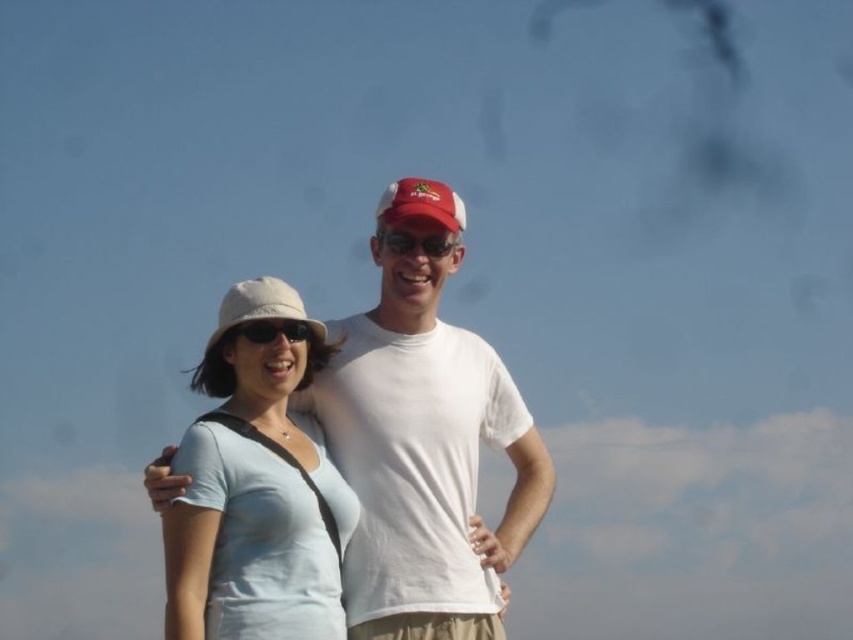
You are a photographer taking a photo of the light blue cotton shirt at center and the beige fabric baseball hat at center. Which object should you focus on first if you want to capture both in sharp focus?

The light blue cotton shirt at center is much taller than the beige fabric baseball hat at center, so you should focus on the taller object first to ensure both are in sharp focus.

You are a photographer trying to capture the light blue cotton shirt at center in the image. Given that the camera focuses on the point marked at coordinates point (424,456), will the light blue cotton shirt at center be in focus?

Yes, the point (424,456) indicates the location of the light blue cotton shirt at center, so the camera will focus on it directly.

In the scene shown: You are a photographer trying to capture a portrait of the light blue fabric shirt at center and the matte red baseball cap at center. Since you want to focus on the shirt, which object should you adjust your camera to prioritize in terms of size in the frame?

The light blue fabric shirt at center has a greater height compared to the matte red baseball cap at center, so you should prioritize focusing on the light blue fabric shirt at center as it is larger in size.